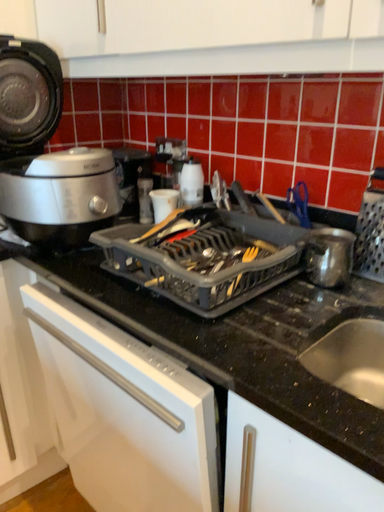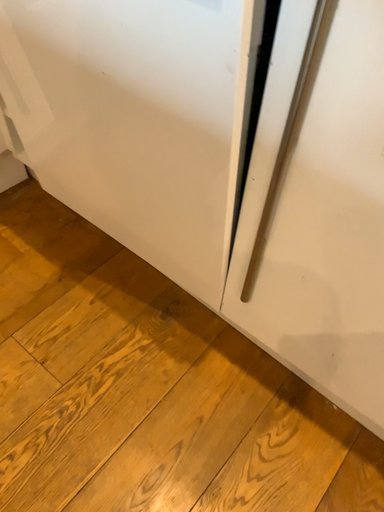
Question: How did the camera likely rotate when shooting the video?

Choices:
 (A) rotated downward
 (B) rotated upward

Answer: (A)